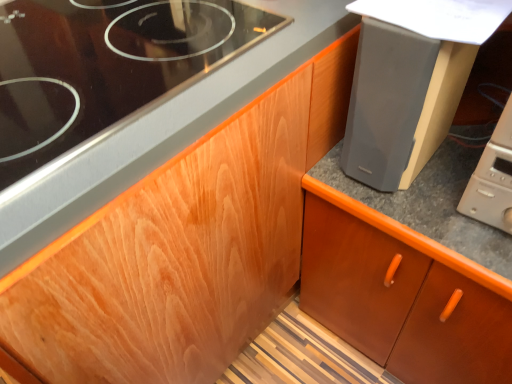
Describe the element at coordinates (402, 294) in the screenshot. The width and height of the screenshot is (512, 384). I see `brown wood cabinet at center` at that location.

This screenshot has height=384, width=512. Describe the element at coordinates (105, 66) in the screenshot. I see `black glass gas stove at upper left` at that location.

Find the location of `matte gray speaker at upper right`. matte gray speaker at upper right is located at coordinates (386, 102).

Considering the relative positions of beige plastic microwave at lower right and brown wood cabinet at center in the image provided, is beige plastic microwave at lower right behind brown wood cabinet at center?

No.

Does beige plastic microwave at lower right have a greater height compared to brown wood cabinet at center?

In fact, beige plastic microwave at lower right may be shorter than brown wood cabinet at center.

Is beige plastic microwave at lower right with brown wood cabinet at center?

No, beige plastic microwave at lower right is not beside brown wood cabinet at center.

From a real-world perspective, is beige plastic microwave at lower right physically below brown wood cabinet at center?

Incorrect, from a real-world perspective, beige plastic microwave at lower right is higher than brown wood cabinet at center.

Is beige plastic microwave at lower right oriented away from black glass gas stove at upper left?

beige plastic microwave at lower right is not turned away from black glass gas stove at upper left.

Is beige plastic microwave at lower right positioned in front of black glass gas stove at upper left?

No.

Can you see beige plastic microwave at lower right touching black glass gas stove at upper left?

There is a gap between beige plastic microwave at lower right and black glass gas stove at upper left.

Considering the relative sizes of beige plastic microwave at lower right and black glass gas stove at upper left in the image provided, is beige plastic microwave at lower right bigger than black glass gas stove at upper left?

No, beige plastic microwave at lower right is not bigger than black glass gas stove at upper left.

Considering the sizes of objects beige plastic microwave at lower right and matte gray speaker at upper right in the image provided, who is smaller, beige plastic microwave at lower right or matte gray speaker at upper right?

beige plastic microwave at lower right is smaller.

From the picture: Can you tell me how much beige plastic microwave at lower right and matte gray speaker at upper right differ in facing direction?

The facing directions of beige plastic microwave at lower right and matte gray speaker at upper right are 0.000202 degrees apart.

Relative to matte gray speaker at upper right, is beige plastic microwave at lower right in front or behind?

Visually, beige plastic microwave at lower right is located in front of matte gray speaker at upper right.

Is beige plastic microwave at lower right inside or outside of matte gray speaker at upper right?

The correct answer is: outside.

Considering the points (373, 48) and (21, 160), which point is in front, point (373, 48) or point (21, 160)?

The point (21, 160) is closer to the camera.

Is matte gray speaker at upper right bigger than black glass gas stove at upper left?

No.

Between matte gray speaker at upper right and black glass gas stove at upper left, which one has more height?

matte gray speaker at upper right.

In order to click on gas stove that appears in front of the matte gray speaker at upper right in this screenshot , I will do `click(105, 66)`.

Does matte gray speaker at upper right have a lesser width compared to beige plastic microwave at lower right?

No, matte gray speaker at upper right is not thinner than beige plastic microwave at lower right.

Is matte gray speaker at upper right facing away from beige plastic microwave at lower right?

No.

Would you say matte gray speaker at upper right is outside beige plastic microwave at lower right?

That's correct, matte gray speaker at upper right is outside of beige plastic microwave at lower right.

Who is shorter, matte gray speaker at upper right or beige plastic microwave at lower right?

beige plastic microwave at lower right is shorter.

Can you tell me how much black glass gas stove at upper left and matte gray speaker at upper right differ in facing direction?

90 degrees separate the facing orientations of black glass gas stove at upper left and matte gray speaker at upper right.

Are black glass gas stove at upper left and matte gray speaker at upper right located far from each other?

No, there isn't a large distance between black glass gas stove at upper left and matte gray speaker at upper right.

Locate an element on the screen. The width and height of the screenshot is (512, 384). appliance that is below the black glass gas stove at upper left (from the image's perspective) is located at coordinates (386, 102).

Relative to matte gray speaker at upper right, is black glass gas stove at upper left in front or behind?

In the image, black glass gas stove at upper left appears in front of matte gray speaker at upper right.

Considering their positions, is brown wood cabinet at center located in front of or behind black glass gas stove at upper left?

brown wood cabinet at center is behind black glass gas stove at upper left.

Visually, is brown wood cabinet at center positioned to the left or to the right of black glass gas stove at upper left?

Based on their positions, brown wood cabinet at center is located to the right of black glass gas stove at upper left.

Can you confirm if brown wood cabinet at center is bigger than black glass gas stove at upper left?

Yes, brown wood cabinet at center is bigger than black glass gas stove at upper left.

This screenshot has height=384, width=512. There is a brown wood cabinet at center. What are the coordinates of `home appliance above it (from a real-world perspective)` in the screenshot? It's located at (493, 178).

The height and width of the screenshot is (384, 512). In order to click on gas stove on the left of beige plastic microwave at lower right in this screenshot , I will do `click(105, 66)`.

From the picture: Estimate the real-world distances between objects in this image. Which object is further from matte gray speaker at upper right, beige plastic microwave at lower right or black glass gas stove at upper left?

Among the two, black glass gas stove at upper left is located further to matte gray speaker at upper right.

Looking at the image, which one is located further to beige plastic microwave at lower right, matte gray speaker at upper right or black glass gas stove at upper left?

The object further to beige plastic microwave at lower right is black glass gas stove at upper left.

Estimate the real-world distances between objects in this image. Which object is further from brown wood cabinet at center, matte gray speaker at upper right or black glass gas stove at upper left?

black glass gas stove at upper left is positioned further to the anchor brown wood cabinet at center.

Estimate the real-world distances between objects in this image. Which object is closer to black glass gas stove at upper left, brown wood cabinet at center or beige plastic microwave at lower right?

brown wood cabinet at center lies closer to black glass gas stove at upper left than the other object.

Which object lies further to the anchor point beige plastic microwave at lower right, brown wood cabinet at center or black glass gas stove at upper left?

Among the two, black glass gas stove at upper left is located further to beige plastic microwave at lower right.

Which object lies nearer to the anchor point matte gray speaker at upper right, beige plastic microwave at lower right or brown wood cabinet at center?

beige plastic microwave at lower right is positioned closer to the anchor matte gray speaker at upper right.

When comparing their distances from black glass gas stove at upper left, does matte gray speaker at upper right or brown wood cabinet at center seem further?

The object further to black glass gas stove at upper left is brown wood cabinet at center.

From the image, which object appears to be nearer to beige plastic microwave at lower right, black glass gas stove at upper left or matte gray speaker at upper right?

Based on the image, matte gray speaker at upper right appears to be nearer to beige plastic microwave at lower right.

Identify the location of appliance situated between black glass gas stove at upper left and beige plastic microwave at lower right from left to right. (386, 102).

Locate an element on the screen. home appliance between matte gray speaker at upper right and brown wood cabinet at center vertically is located at coordinates click(x=493, y=178).

The width and height of the screenshot is (512, 384). I want to click on home appliance between black glass gas stove at upper left and brown wood cabinet at center in the horizontal direction, so click(493, 178).

Where is `appliance between black glass gas stove at upper left and brown wood cabinet at center in the horizontal direction`? appliance between black glass gas stove at upper left and brown wood cabinet at center in the horizontal direction is located at coordinates (386, 102).